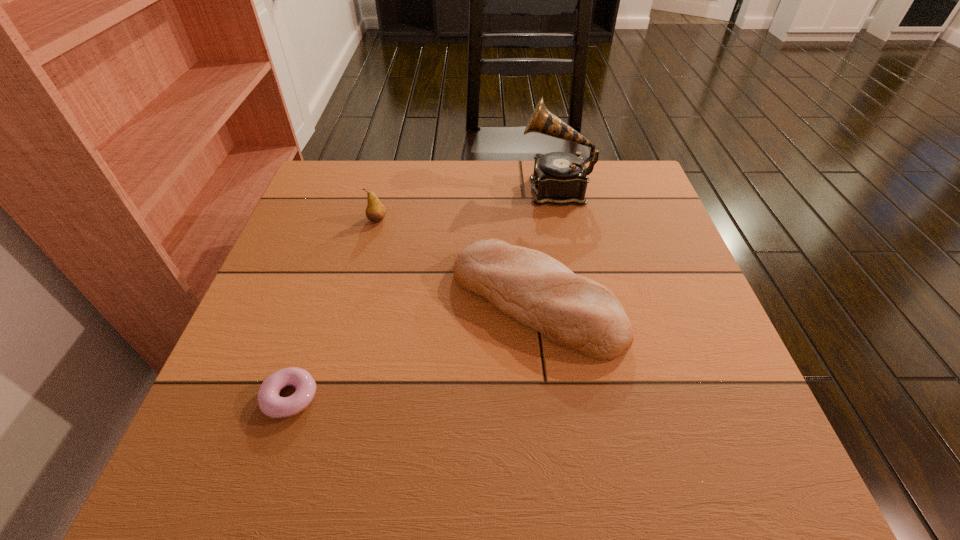
Find the location of a particular element. The image size is (960, 540). free space located 0.380m on the left of the second nearest object is located at coordinates (272, 301).

Find the location of a particular element. free space located on the back of the doughnut is located at coordinates (325, 289).

Locate an element on the screen. This screenshot has width=960, height=540. object situated at the far edge is located at coordinates (560, 178).

I want to click on object located at the left edge, so click(x=270, y=403).

The width and height of the screenshot is (960, 540). What are the coordinates of `object at the right edge` in the screenshot? It's located at (560, 178).

What are the coordinates of `object that is positioned at the far right corner` in the screenshot? It's located at (560, 178).

In the image, there is a desktop. What are the coordinates of `vacant space at the far edge` in the screenshot? It's located at (493, 172).

Identify the location of free region at the near edge. This screenshot has width=960, height=540. (432, 482).

The width and height of the screenshot is (960, 540). What are the coordinates of `vacant space at the right edge of the desktop` in the screenshot? It's located at 703,321.

Where is `vacant region at the far left corner of the desktop`? vacant region at the far left corner of the desktop is located at coordinates (358, 197).